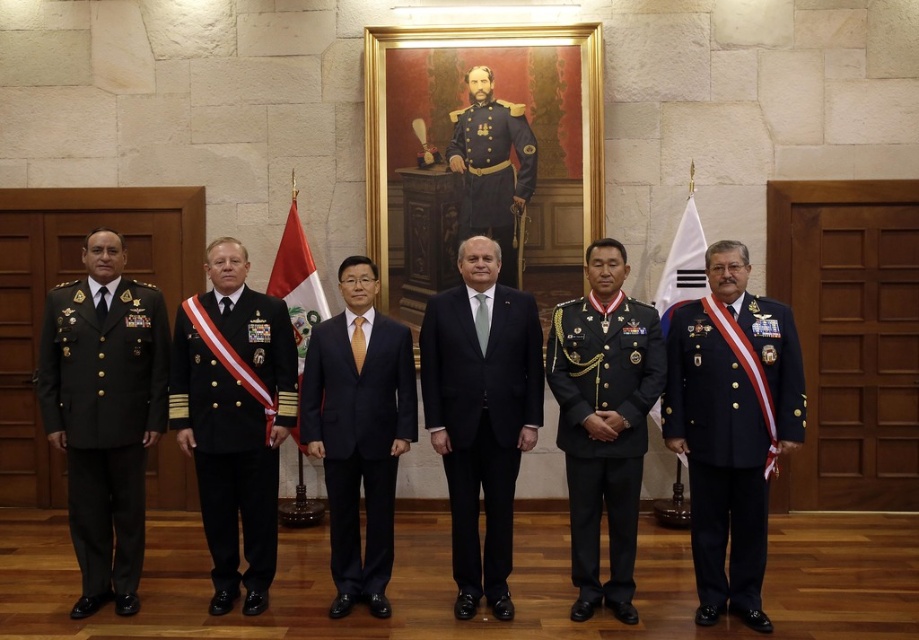
Question: In this image, where is shiny black fabric military uniform at center located relative to white fabric flag at right?

Choices:
 (A) right
 (B) left

Answer: (B)

Question: Which is nearer to the red fabric flag at center?

Choices:
 (A) shiny black uniform at center
 (B) shiny black fabric military uniform at center
 (C) dark blue fabric military uniform at right

Answer: (B)

Question: Does dark blue fabric military uniform at right lie behind red fabric flag at center?

Choices:
 (A) no
 (B) yes

Answer: (A)

Question: Which of the following is the closest to the observer?

Choices:
 (A) dark blue fabric military uniform at right
 (B) shiny black fabric military uniform at center

Answer: (A)

Question: Is black satin suit at center thinner than navy blue suit at center?

Choices:
 (A) no
 (B) yes

Answer: (A)

Question: Which of these objects is positioned closest to the dark blue fabric military uniform at right?

Choices:
 (A) dark blue fabric uniform at center
 (B) black satin suit at center
 (C) shiny black fabric military uniform at center

Answer: (B)